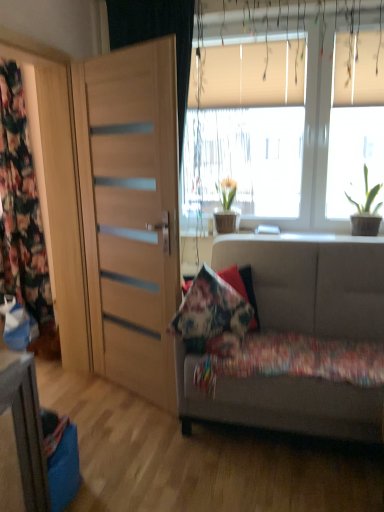
Where is `vacant region in front of light wood door at left`? The image size is (384, 512). vacant region in front of light wood door at left is located at coordinates (141, 438).